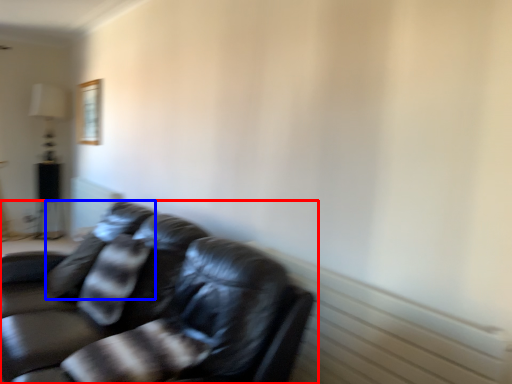
Question: Which object appears closest to the camera in this image, studio couch (highlighted by a red box) or pillow (highlighted by a blue box)?

Choices:
 (A) studio couch
 (B) pillow

Answer: (A)